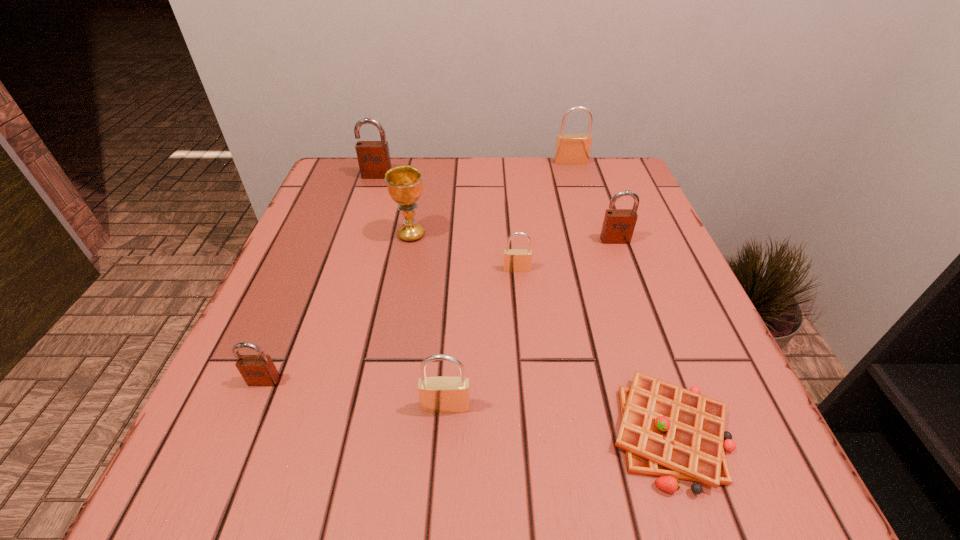
Where is `vacant region at the left edge of the desktop`? vacant region at the left edge of the desktop is located at coordinates (267, 429).

The image size is (960, 540). Find the location of `free space at the right edge`. free space at the right edge is located at coordinates (632, 300).

At what (x,y) coordinates should I click in order to perform the action: click on vacant space at the far left corner of the desktop. Please return your answer as a coordinate pair (x, y). This screenshot has width=960, height=540. Looking at the image, I should click on (334, 190).

Where is `free space at the near left corner of the desktop`? The width and height of the screenshot is (960, 540). free space at the near left corner of the desktop is located at coordinates coord(208,446).

Identify the location of vacant space at the far right corner of the desktop. (624, 172).

In order to click on free space at the near right corner in this screenshot , I will do `click(781, 470)`.

You are a GUI agent. You are given a task and a screenshot of the screen. Output one action in this format:
    pyautogui.click(x=<x>, y=<y>)
    Task: Click on the free area in between the second farthest brown padlock and the leftmost padlock
    The image size is (960, 540).
    Given the screenshot: What is the action you would take?
    pyautogui.click(x=440, y=310)

Find the location of a particular element. The width and height of the screenshot is (960, 540). unoccupied area between the rightmost brass padlock and the leftmost padlock is located at coordinates (418, 272).

Locate an element on the screen. free space between the second padlock from left to right and the leftmost brass padlock is located at coordinates (411, 291).

Locate an element on the screen. The width and height of the screenshot is (960, 540). free spot between the farthest brown padlock and the nearest padlock is located at coordinates (411, 291).